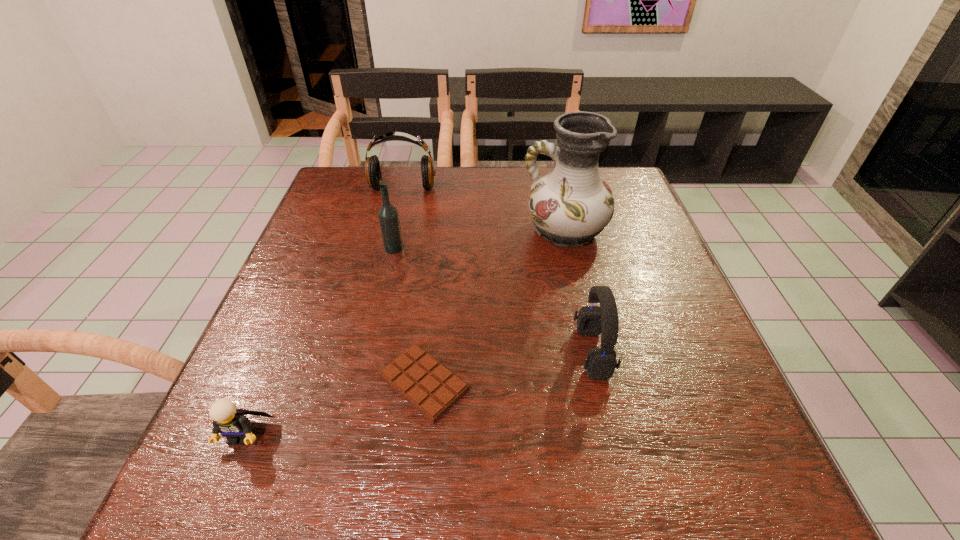
Locate an element on the screen. This screenshot has height=540, width=960. free region located 0.280m on the ear cups of the farther headset is located at coordinates (386, 259).

The height and width of the screenshot is (540, 960). I want to click on vacant space located on the headband of the nearer headset, so click(x=535, y=352).

Identify the location of free space located on the headband of the nearer headset. click(x=391, y=352).

Identify the location of blank area located on the headband of the nearer headset. Image resolution: width=960 pixels, height=540 pixels. (473, 352).

You are a GUI agent. You are given a task and a screenshot of the screen. Output one action in this format:
    pyautogui.click(x=<x>, y=<y>)
    Task: Click on the vacant region located on the front-facing side of the leftmost object
    The height and width of the screenshot is (540, 960).
    Given the screenshot: What is the action you would take?
    pyautogui.click(x=211, y=512)

Image resolution: width=960 pixels, height=540 pixels. Find the location of `free space located on the right of the candy bar`. free space located on the right of the candy bar is located at coordinates (514, 383).

Find the location of a particular element. This screenshot has height=540, width=960. vase that is at the far edge is located at coordinates (571, 205).

Image resolution: width=960 pixels, height=540 pixels. Identify the location of headset situated at the far edge. (372, 166).

The image size is (960, 540). I want to click on headset that is at the left edge, so click(x=372, y=166).

Image resolution: width=960 pixels, height=540 pixels. I want to click on Lego positioned at the left edge, so click(232, 423).